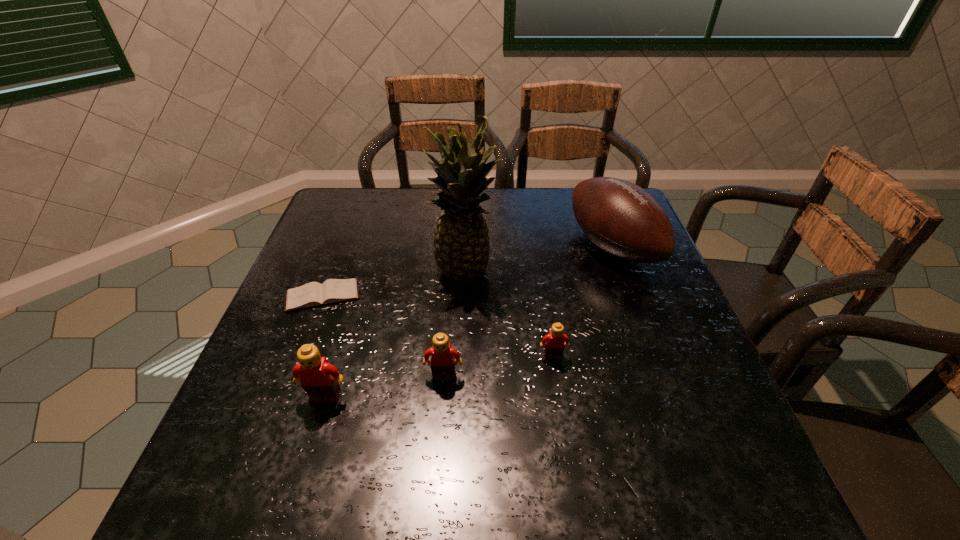
Find the location of a particular element. blank area located on the face of the nearest object is located at coordinates (316, 430).

This screenshot has width=960, height=540. Identify the location of free space located 0.090m on the face of the second shortest Lego. (441, 423).

Identify the location of vacant space located 0.110m on the front of the football (American). This screenshot has width=960, height=540. (638, 318).

Find the location of a particular element. The height and width of the screenshot is (540, 960). free spot located 0.160m on the back of the tallest object is located at coordinates (468, 218).

You are a GUI agent. You are given a task and a screenshot of the screen. Output one action in this format:
    pyautogui.click(x=<x>, y=<y>)
    Task: Click on the vacant area situated 0.230m on the front of the diary
    The height and width of the screenshot is (540, 960).
    Given the screenshot: What is the action you would take?
    pyautogui.click(x=284, y=399)

Where is `object present at the far edge`? The height and width of the screenshot is (540, 960). object present at the far edge is located at coordinates (622, 219).

Locate an element on the screen. object located in the near edge section of the desktop is located at coordinates (319, 379).

In order to click on Lego that is at the left edge in this screenshot , I will do `click(319, 379)`.

Image resolution: width=960 pixels, height=540 pixels. In order to click on diary located at the left edge in this screenshot , I will do `click(313, 294)`.

Locate an element on the screen. The width and height of the screenshot is (960, 540). object that is at the right edge is located at coordinates (622, 219).